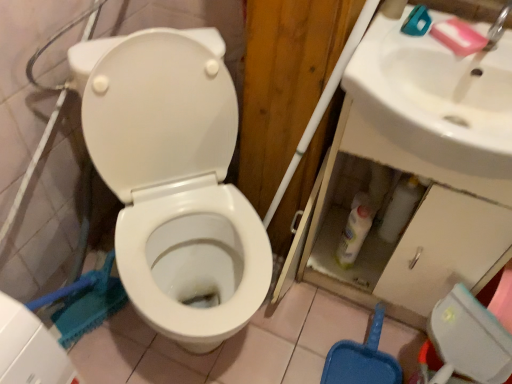
The width and height of the screenshot is (512, 384). I want to click on free location to the left of pink matte soap at upper right, so click(402, 46).